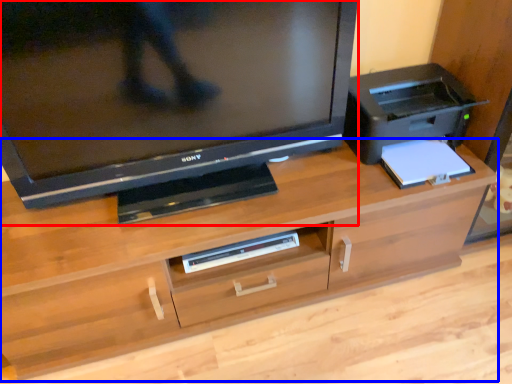
Question: Which of the following is the closest to the observer, television (highlighted by a red box) or desk (highlighted by a blue box)?

Choices:
 (A) television
 (B) desk

Answer: (A)